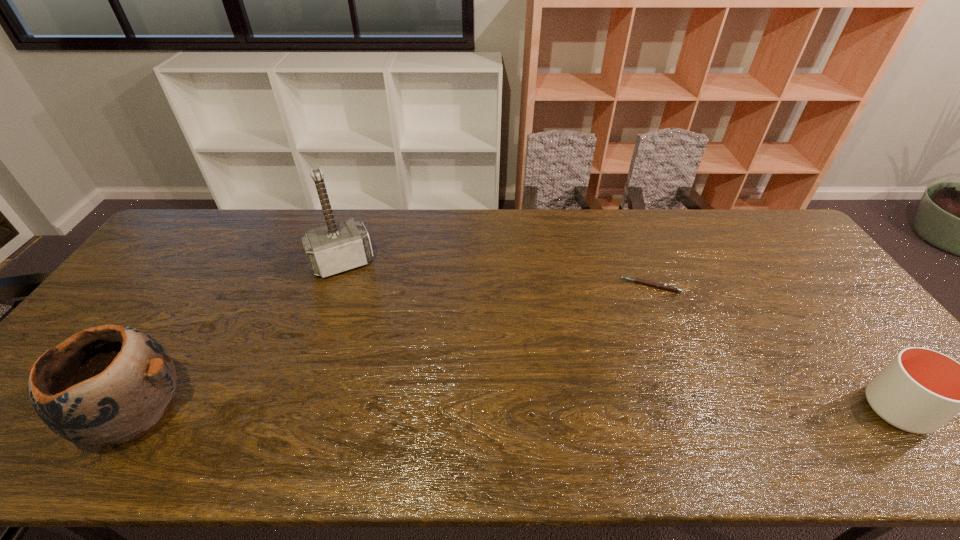
This screenshot has height=540, width=960. Find the location of `object present at the right edge`. object present at the right edge is located at coordinates (920, 390).

The height and width of the screenshot is (540, 960). In order to click on object at the near left corner in this screenshot , I will do `click(112, 383)`.

Where is `object located in the near right corner section of the desktop`? This screenshot has height=540, width=960. object located in the near right corner section of the desktop is located at coordinates (920, 390).

You are a GUI agent. You are given a task and a screenshot of the screen. Output one action in this format:
    pyautogui.click(x=<x>, y=<y>)
    Task: Click on the vacant space at the far edge of the desktop
    Image resolution: width=960 pixels, height=540 pixels.
    Given the screenshot: What is the action you would take?
    pyautogui.click(x=661, y=226)

Locate an element on the screen. The width and height of the screenshot is (960, 540). vacant space at the near edge of the desktop is located at coordinates (252, 404).

I want to click on free space at the left edge of the desktop, so click(105, 311).

Find the location of a particular element. vacant space at the right edge of the desktop is located at coordinates (798, 269).

Find the location of `free space at the far left corner of the desktop`. free space at the far left corner of the desktop is located at coordinates (203, 228).

Image resolution: width=960 pixels, height=540 pixels. Find the location of `unoccupied area between the leftmost object and the pen`. unoccupied area between the leftmost object and the pen is located at coordinates (394, 349).

You are a GUI agent. You are given a task and a screenshot of the screen. Output one action in this format:
    pyautogui.click(x=<x>, y=<y>)
    Task: Click on the free area in between the pen and the rightmost object
    The width and height of the screenshot is (960, 540).
    Given the screenshot: What is the action you would take?
    pyautogui.click(x=774, y=347)